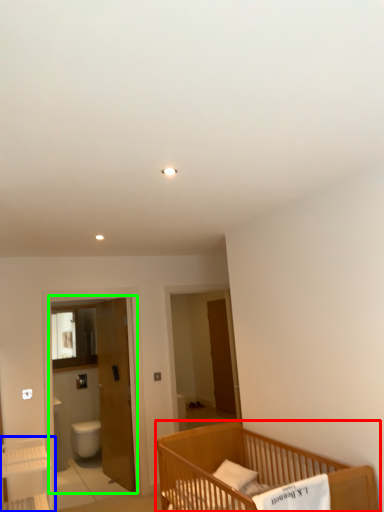
Question: Which object is positioned farthest from infant bed (highlighted by a red box)? Select from table (highlighted by a blue box) and screen door (highlighted by a green box).

Choices:
 (A) table
 (B) screen door

Answer: (B)